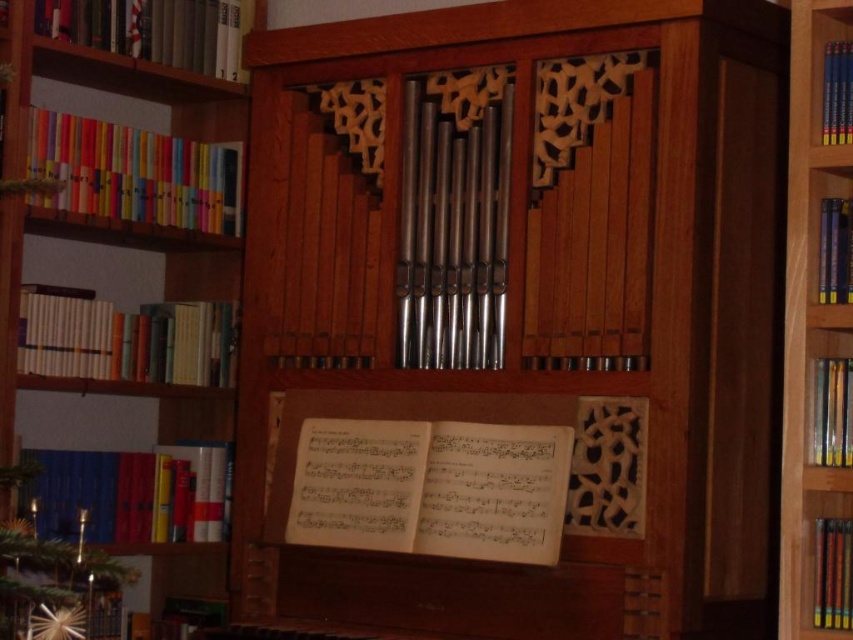
Question: Which object appears farthest from the camera in this image?

Choices:
 (A) wooden bookcase at left
 (B) blue hardcover books at right

Answer: (A)

Question: Does wooden bookcase at left appear on the right side of blue hardcover books at right?

Choices:
 (A) yes
 (B) no

Answer: (B)

Question: Which object appears farthest from the camera in this image?

Choices:
 (A) blue hardcover books at right
 (B) wooden pipe organ at center
 (C) wooden bookcase at left

Answer: (C)

Question: Based on their relative distances, which object is nearer to the wooden pipe organ at center?

Choices:
 (A) blue hardcover books at right
 (B) wooden bookcase at left

Answer: (A)

Question: Does wooden pipe organ at center have a lesser width compared to wooden bookcase at left?

Choices:
 (A) yes
 (B) no

Answer: (B)

Question: Can you confirm if wooden pipe organ at center is positioned to the right of wooden bookcase at left?

Choices:
 (A) yes
 (B) no

Answer: (A)